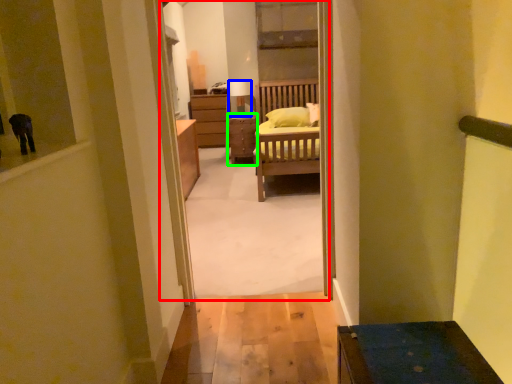
Question: Which is farther away from corridor (highlighted by a red box)? lamp (highlighted by a blue box) or table (highlighted by a green box)?

Choices:
 (A) lamp
 (B) table

Answer: (B)